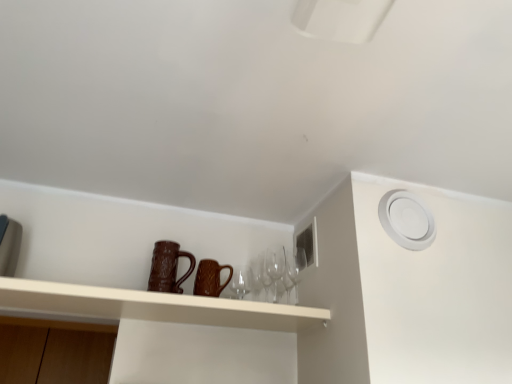
This screenshot has width=512, height=384. What do you see at coordinates (294, 274) in the screenshot? I see `transparent glass wine glass at center, the second wine glass when ordered from left to right` at bounding box center [294, 274].

What do you see at coordinates (154, 306) in the screenshot? The image size is (512, 384). I see `matte brown mugs at center` at bounding box center [154, 306].

You are a GUI agent. You are given a task and a screenshot of the screen. Output one action in this format:
    pyautogui.click(x=<x>, y=<y>)
    Task: Click on the transparent glass wine glass at center, marked as the first wine glass in a right-to-left arrangement
    
    Given the screenshot: What is the action you would take?
    pyautogui.click(x=294, y=274)

How many degrees apart are the facing directions of brown textured mug at center, acting as the 1th mug starting from the right, and brown textured mug at center, the 1th mug viewed from the left?

The facing directions of brown textured mug at center, acting as the 1th mug starting from the right, and brown textured mug at center, the 1th mug viewed from the left, are 0 degrees apart.

From the image's perspective, is brown textured mug at center, the second mug from the left, beneath brown textured mug at center, the 1th mug viewed from the left?

Yes, from the image's perspective, brown textured mug at center, the second mug from the left, is beneath brown textured mug at center, the 1th mug viewed from the left.

Locate an element on the screen. This screenshot has width=512, height=384. mug to the right of brown textured mug at center, the 1th mug viewed from the left is located at coordinates (210, 278).

Which of these two, brown textured mug at center, acting as the 1th mug starting from the right, or brown textured mug at center, the 1th mug viewed from the left, is bigger?

brown textured mug at center, the 1th mug viewed from the left.

From the image's perspective, between transparent glass wine glasses at center, the 2th wine glass positioned from the right, and brown textured mug at center, the second mug from the left, who is located below?

transparent glass wine glasses at center, the 2th wine glass positioned from the right, is shown below in the image.

In the scene shown: From a real-world perspective, is transparent glass wine glasses at center, the 2th wine glass positioned from the right, over brown textured mug at center, acting as the 1th mug starting from the right?

Yes, from a real-world perspective, transparent glass wine glasses at center, the 2th wine glass positioned from the right, is above brown textured mug at center, acting as the 1th mug starting from the right.

Between transparent glass wine glasses at center, which is counted as the first wine glass, starting from the left, and brown textured mug at center, acting as the 1th mug starting from the right, which one has more height?

Standing taller between the two is transparent glass wine glasses at center, which is counted as the first wine glass, starting from the left.

Is transparent glass wine glasses at center, which is counted as the first wine glass, starting from the left, far from brown textured mug at center, the second mug from the left?

They are positioned close to each other.

Could you tell me if brown textured mug at center, the 1th mug viewed from the left, is turned towards transparent glass wine glasses at center, the 2th wine glass positioned from the right?

No, brown textured mug at center, the 1th mug viewed from the left, is not facing towards transparent glass wine glasses at center, the 2th wine glass positioned from the right.

Is transparent glass wine glasses at center, which is counted as the first wine glass, starting from the left, located within brown textured mug at center, marked as the 2th mug in a right-to-left arrangement?

No, transparent glass wine glasses at center, which is counted as the first wine glass, starting from the left, is not surrounded by brown textured mug at center, marked as the 2th mug in a right-to-left arrangement.

Is brown textured mug at center, marked as the 2th mug in a right-to-left arrangement, taller than transparent glass wine glasses at center, which is counted as the first wine glass, starting from the left?

In fact, brown textured mug at center, marked as the 2th mug in a right-to-left arrangement, may be shorter than transparent glass wine glasses at center, which is counted as the first wine glass, starting from the left.

From the image's perspective, which object appears higher, transparent glass wine glasses at center, the 2th wine glass positioned from the right, or matte brown mugs at center?

transparent glass wine glasses at center, the 2th wine glass positioned from the right, from the image's perspective.

Looking at this image, which is more distant, (x=279, y=293) or (x=50, y=282)?

Point (x=279, y=293)

Is transparent glass wine glasses at center, which is counted as the first wine glass, starting from the left, aimed at matte brown mugs at center?

No, transparent glass wine glasses at center, which is counted as the first wine glass, starting from the left, is not oriented towards matte brown mugs at center.

Can transparent glass wine glass at center, marked as the first wine glass in a right-to-left arrangement, be found inside transparent glass wine glasses at center, which is counted as the first wine glass, starting from the left?

That's incorrect, transparent glass wine glass at center, marked as the first wine glass in a right-to-left arrangement, is not inside transparent glass wine glasses at center, which is counted as the first wine glass, starting from the left.

From the image's perspective, is transparent glass wine glasses at center, the 2th wine glass positioned from the right, below transparent glass wine glass at center, marked as the first wine glass in a right-to-left arrangement?

Incorrect, from the image's perspective, transparent glass wine glasses at center, the 2th wine glass positioned from the right, is higher than transparent glass wine glass at center, marked as the first wine glass in a right-to-left arrangement.

Identify the location of wine glass above the transparent glass wine glasses at center, the 2th wine glass positioned from the right (from a real-world perspective). This screenshot has width=512, height=384. (294, 274).

Considering the positions of points (176, 251) and (221, 291), is point (176, 251) closer to camera compared to point (221, 291)?

No, it is not.

Considering the relative sizes of brown textured mug at center, the 1th mug viewed from the left, and brown textured mug at center, acting as the 1th mug starting from the right, in the image provided, is brown textured mug at center, the 1th mug viewed from the left, bigger than brown textured mug at center, acting as the 1th mug starting from the right,?

Correct, brown textured mug at center, the 1th mug viewed from the left, is larger in size than brown textured mug at center, acting as the 1th mug starting from the right.

Considering the relative positions of brown textured mug at center, the 1th mug viewed from the left, and brown textured mug at center, the second mug from the left, in the image provided, is brown textured mug at center, the 1th mug viewed from the left, to the left of brown textured mug at center, the second mug from the left, from the viewer's perspective?

Yes.

Consider the image. Between brown textured mug at center, the 1th mug viewed from the left, and brown textured mug at center, the second mug from the left, which one has less height?

brown textured mug at center, the second mug from the left.

Considering the relative sizes of matte brown mugs at center and transparent glass wine glasses at center, the 2th wine glass positioned from the right, in the image provided, is matte brown mugs at center thinner than transparent glass wine glasses at center, the 2th wine glass positioned from the right,?

In fact, matte brown mugs at center might be wider than transparent glass wine glasses at center, the 2th wine glass positioned from the right.

Is matte brown mugs at center not near transparent glass wine glasses at center, the 2th wine glass positioned from the right?

No.

From their relative heights in the image, would you say matte brown mugs at center is taller or shorter than transparent glass wine glasses at center, which is counted as the first wine glass, starting from the left?

Clearly, matte brown mugs at center is shorter compared to transparent glass wine glasses at center, which is counted as the first wine glass, starting from the left.

Would you say matte brown mugs at center is to the left or to the right of transparent glass wine glasses at center, the 2th wine glass positioned from the right, in the picture?

matte brown mugs at center is positioned on transparent glass wine glasses at center, the 2th wine glass positioned from the right,'s left side.

Identify the location of mug on the left side of brown textured mug at center, the second mug from the left. The width and height of the screenshot is (512, 384). (168, 267).

From the image's perspective, which wine glass is the 1st one below the brown textured mug at center, the second mug from the left? Please provide its 2D coordinates.

[(275, 270)]

From the image, which object appears to be nearer to brown textured mug at center, the 1th mug viewed from the left, matte brown mugs at center or brown textured mug at center, acting as the 1th mug starting from the right?

brown textured mug at center, acting as the 1th mug starting from the right, is closer to brown textured mug at center, the 1th mug viewed from the left.

Looking at the image, which one is located further to transparent glass wine glasses at center, which is counted as the first wine glass, starting from the left, brown textured mug at center, marked as the 2th mug in a right-to-left arrangement, or transparent glass wine glass at center, marked as the first wine glass in a right-to-left arrangement?

Based on the image, brown textured mug at center, marked as the 2th mug in a right-to-left arrangement, appears to be further to transparent glass wine glasses at center, which is counted as the first wine glass, starting from the left.

Based on their spatial positions, is matte brown mugs at center or brown textured mug at center, the 1th mug viewed from the left, further from transparent glass wine glasses at center, the 2th wine glass positioned from the right?

Among the two, matte brown mugs at center is located further to transparent glass wine glasses at center, the 2th wine glass positioned from the right.

Looking at the image, which one is located closer to transparent glass wine glass at center, the second wine glass when ordered from left to right, brown textured mug at center, acting as the 1th mug starting from the right, or transparent glass wine glasses at center, the 2th wine glass positioned from the right?

transparent glass wine glasses at center, the 2th wine glass positioned from the right, lies closer to transparent glass wine glass at center, the second wine glass when ordered from left to right, than the other object.

From the picture: Considering their positions, is brown textured mug at center, the 1th mug viewed from the left, positioned closer to transparent glass wine glasses at center, the 2th wine glass positioned from the right, than brown textured mug at center, the second mug from the left?

brown textured mug at center, the second mug from the left, lies closer to transparent glass wine glasses at center, the 2th wine glass positioned from the right, than the other object.

Considering their positions, is transparent glass wine glass at center, the second wine glass when ordered from left to right, positioned further to transparent glass wine glasses at center, which is counted as the first wine glass, starting from the left, than brown textured mug at center, acting as the 1th mug starting from the right?

Among the two, brown textured mug at center, acting as the 1th mug starting from the right, is located further to transparent glass wine glasses at center, which is counted as the first wine glass, starting from the left.

Looking at the image, which one is located further to brown textured mug at center, the 1th mug viewed from the left, transparent glass wine glass at center, the second wine glass when ordered from left to right, or transparent glass wine glasses at center, the 2th wine glass positioned from the right?

transparent glass wine glass at center, the second wine glass when ordered from left to right.

Which object lies nearer to the anchor point brown textured mug at center, marked as the 2th mug in a right-to-left arrangement, transparent glass wine glasses at center, the 2th wine glass positioned from the right, or brown textured mug at center, acting as the 1th mug starting from the right?

brown textured mug at center, acting as the 1th mug starting from the right, is closer to brown textured mug at center, marked as the 2th mug in a right-to-left arrangement.

The height and width of the screenshot is (384, 512). Identify the location of mug between matte brown mugs at center and brown textured mug at center, acting as the 1th mug starting from the right, in the front-back direction. (168, 267).

I want to click on wine glass between brown textured mug at center, marked as the 2th mug in a right-to-left arrangement, and transparent glass wine glass at center, the second wine glass when ordered from left to right, so click(x=275, y=270).

Locate an element on the screen. This screenshot has width=512, height=384. wine glass between brown textured mug at center, the second mug from the left, and transparent glass wine glass at center, marked as the first wine glass in a right-to-left arrangement is located at coordinates (275, 270).

The width and height of the screenshot is (512, 384). What are the coordinates of `mug located between brown textured mug at center, the 1th mug viewed from the left, and transparent glass wine glass at center, marked as the first wine glass in a right-to-left arrangement, in the left-right direction` in the screenshot? It's located at (210, 278).